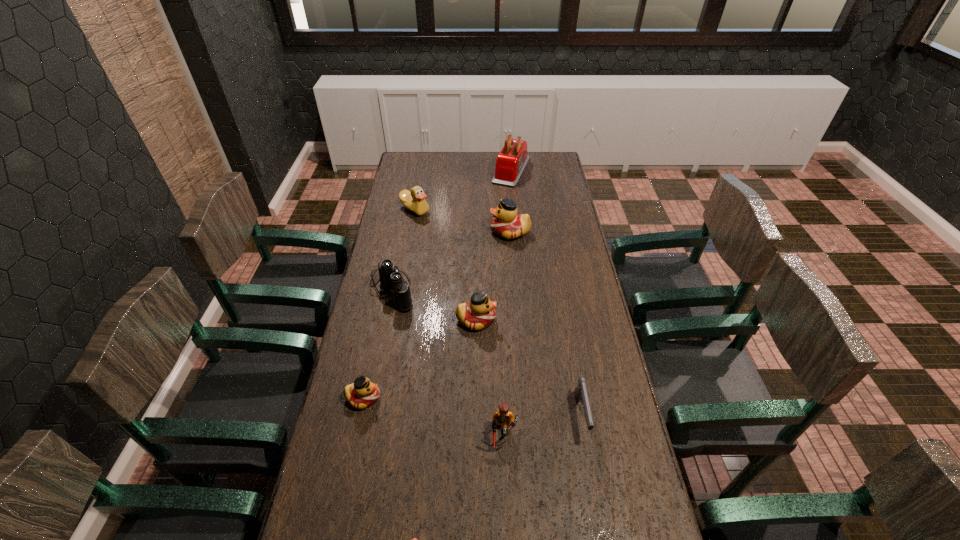
Locate an element on the screen. The image size is (960, 540). duck that is the fourth nearest to the smaller beige duck is located at coordinates (414, 200).

Where is `duck that stands as the second closest to the red toaster`? The width and height of the screenshot is (960, 540). duck that stands as the second closest to the red toaster is located at coordinates (414, 200).

Find the location of `the closest red duck to the pistol`. the closest red duck to the pistol is located at coordinates (479, 313).

You are a GUI agent. You are given a task and a screenshot of the screen. Output one action in this format:
    pyautogui.click(x=<x>, y=<y>)
    Task: Click on the red duck that is the closest to the tallest duck
    
    Given the screenshot: What is the action you would take?
    pyautogui.click(x=479, y=313)

Locate an element on the screen. This screenshot has width=960, height=540. free region that satisfies the following two spatial constraints: 1. on the face of the tallest duck; 2. holding a crossbow in the hands of the Lego is located at coordinates (526, 435).